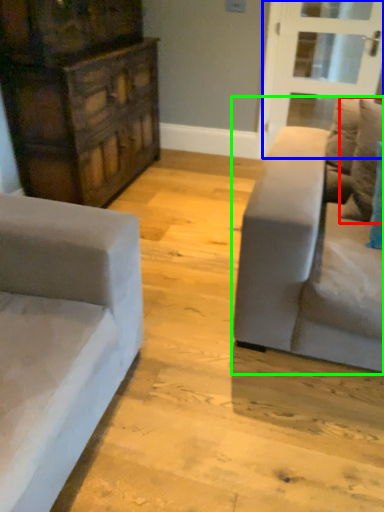
Question: Based on their relative distances, which object is nearer to pillow (highlighted by a red box)? Choose from glass door (highlighted by a blue box) and studio couch (highlighted by a green box).

Choices:
 (A) glass door
 (B) studio couch

Answer: (B)